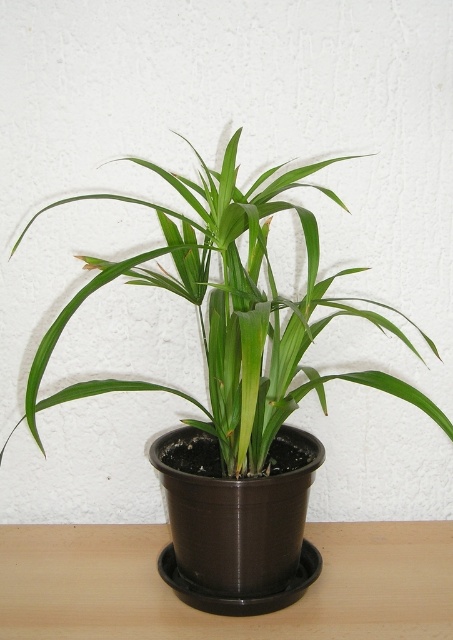
You are positioning a small decorative statue that needs to be placed exactly at the center of the wooden surface. The green matte plant at center is currently occupying the center point. Can you determine if the statue will fit if you move the plant to the left by 10 cm?

The green matte plant at center is located at point (x=231, y=308). Since the statue needs to be placed exactly at the center, moving the plant 10 cm to the left would free up the center point, allowing the statue to be placed there. Therefore, yes, the statue will fit if the plant is moved left by 10 cm.

You are arranging a small table setting for a tea ceremony. You have a green matte plant at center and a brown wooden table at center. Where should you place the tea set to ensure it is centered between both objects?

The tea set should be placed to the right of the green matte plant at center and to the left of the brown wooden table at center since the green matte plant at center is positioned to the left of the brown wooden table at center.

You are a gardener checking the placement of the green matte plant at center and the brown wooden table at center. Which object is positioned higher in the image?

The green matte plant at center is located above the brown wooden table at center, so it is positioned higher.